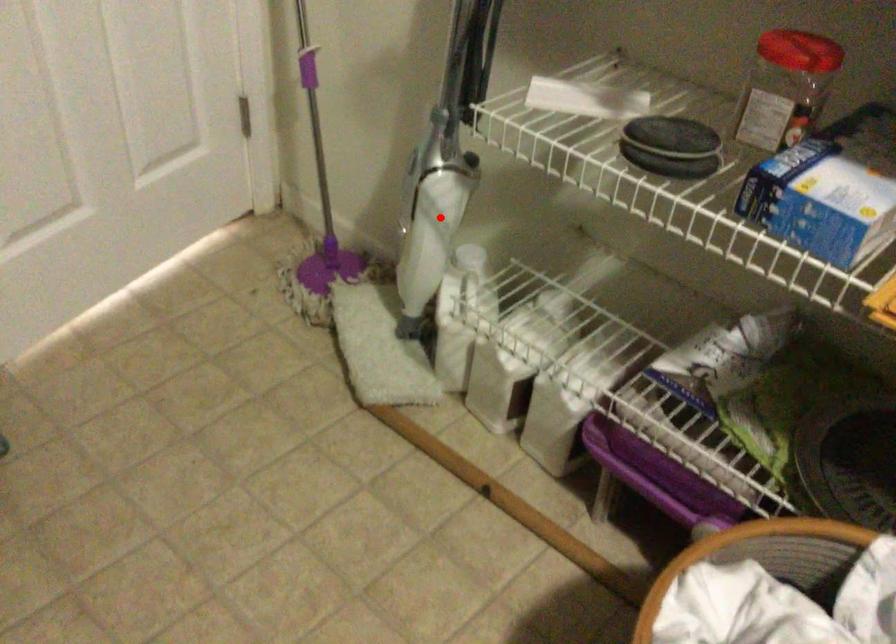
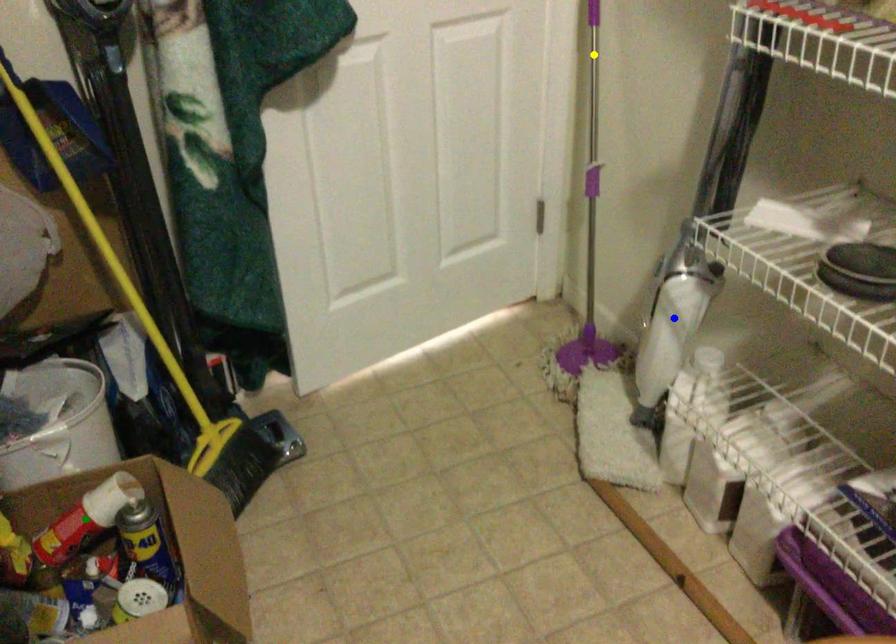
Question: I am providing you with two images of the same scene from different viewpoints. A red point is marked on the first image. You are given multiple points on the second image. Which point in image 2 represents the same 3d spot as the red point in image 1?

Choices:
 (A) green point
 (B) blue point
 (C) yellow point

Answer: (B)